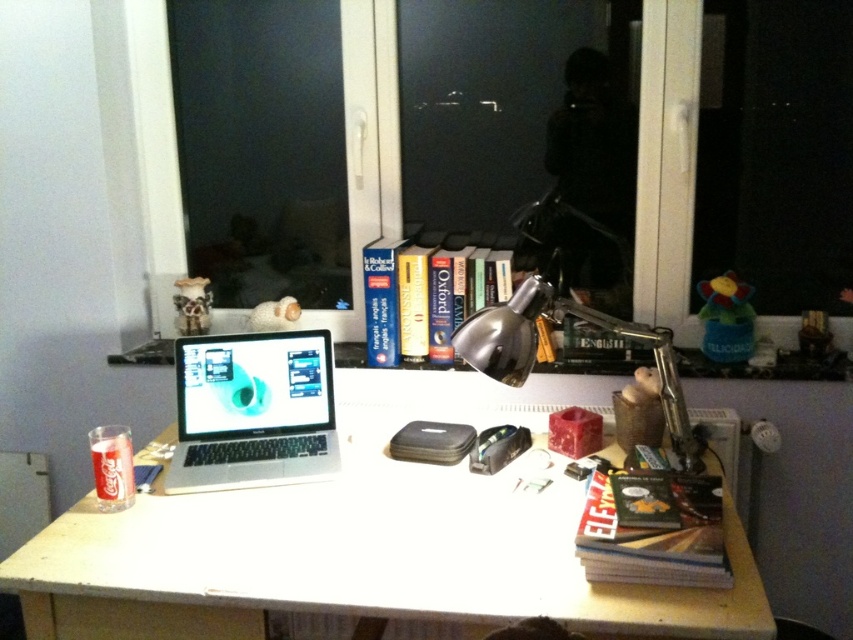
Is white matte table at center above hardcover book at lower right?

No.

Does white matte table at center have a greater width compared to hardcover book at lower right?

Indeed, white matte table at center has a greater width compared to hardcover book at lower right.

This screenshot has height=640, width=853. I want to click on white matte table at center, so click(361, 552).

Can you confirm if transparent glass window at upper center is bigger than hardcover book at center?

Yes.

Does point (178, 237) come in front of point (370, 356)?

That is False.

Where is `transparent glass window at upper center`? The width and height of the screenshot is (853, 640). transparent glass window at upper center is located at coordinates (666, 164).

Between point (209, 342) and point (711, 516), which one is positioned behind?

The point (209, 342) is behind.

Is sleek silver laptop at center taller than hardcover book at lower right?

Indeed, sleek silver laptop at center has a greater height compared to hardcover book at lower right.

What are the coordinates of `sleek silver laptop at center` in the screenshot? It's located at (252, 410).